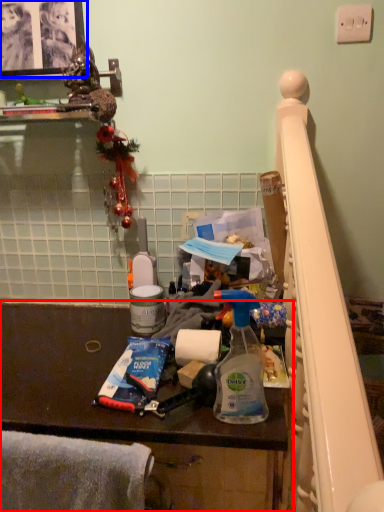
Question: Which point is further to the camera, furniture (highlighted by a red box) or picture frame (highlighted by a blue box)?

Choices:
 (A) furniture
 (B) picture frame

Answer: (B)